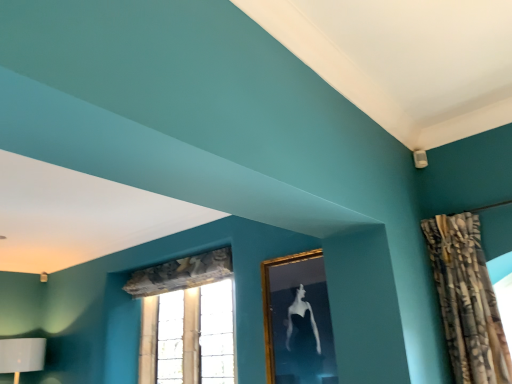
Question: Considering the relative sizes of textured beige curtain at upper right and clear glass window at center in the image provided, is textured beige curtain at upper right wider than clear glass window at center?

Choices:
 (A) yes
 (B) no

Answer: (A)

Question: From a real-world perspective, is textured beige curtain at upper right beneath clear glass window at center?

Choices:
 (A) yes
 (B) no

Answer: (B)

Question: Would you say clear glass window at center is part of textured beige curtain at upper right's contents?

Choices:
 (A) yes
 (B) no

Answer: (B)

Question: From the image's perspective, is textured beige curtain at upper right located beneath clear glass window at center?

Choices:
 (A) yes
 (B) no

Answer: (B)

Question: Does textured beige curtain at upper right have a greater height compared to clear glass window at center?

Choices:
 (A) no
 (B) yes

Answer: (A)

Question: Considering the relative sizes of textured beige curtain at upper right and clear glass window at center in the image provided, is textured beige curtain at upper right shorter than clear glass window at center?

Choices:
 (A) yes
 (B) no

Answer: (A)

Question: Are textured beige curtain at upper right and gold-framed picture at upper center far apart?

Choices:
 (A) yes
 (B) no

Answer: (B)

Question: Is textured beige curtain at upper right to the right of gold-framed picture at upper center from the viewer's perspective?

Choices:
 (A) no
 (B) yes

Answer: (B)

Question: Is gold-framed picture at upper center surrounded by textured beige curtain at upper right?

Choices:
 (A) no
 (B) yes

Answer: (A)

Question: Is textured beige curtain at upper right taller than gold-framed picture at upper center?

Choices:
 (A) yes
 (B) no

Answer: (A)

Question: Could you tell me if textured beige curtain at upper right is turned towards gold-framed picture at upper center?

Choices:
 (A) yes
 (B) no

Answer: (B)

Question: Is textured beige curtain at upper right located outside gold-framed picture at upper center?

Choices:
 (A) no
 (B) yes

Answer: (B)

Question: Is clear glass window at center positioned behind textured beige curtain at upper right?

Choices:
 (A) no
 (B) yes

Answer: (B)